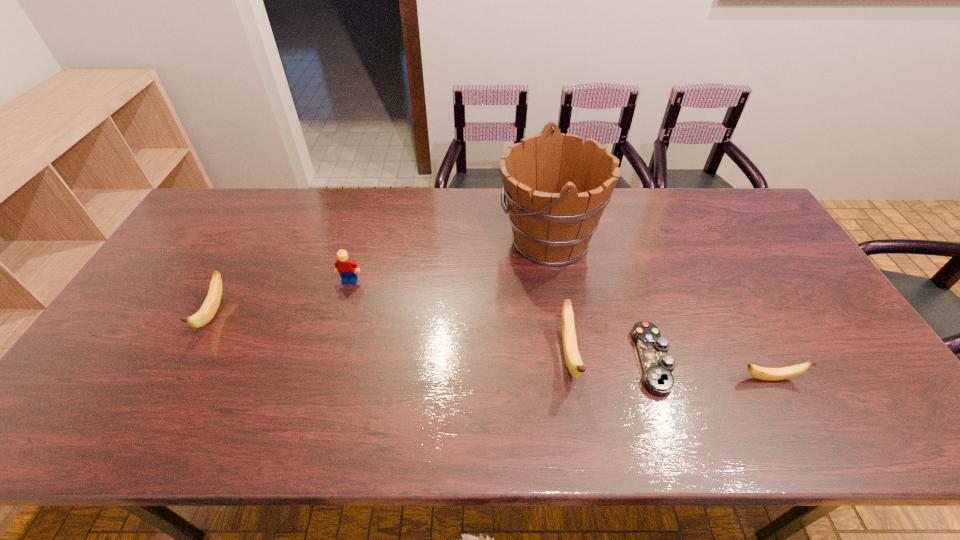
Where is `the second shortest banana`? The image size is (960, 540). the second shortest banana is located at coordinates (206, 313).

Identify the location of the leftmost banana. This screenshot has width=960, height=540. (206, 313).

Image resolution: width=960 pixels, height=540 pixels. I want to click on the second banana from left to right, so click(574, 363).

Where is `the rightmost object`? This screenshot has height=540, width=960. the rightmost object is located at coordinates (770, 374).

Where is `the fifth tallest object`? The image size is (960, 540). the fifth tallest object is located at coordinates (x=770, y=374).

Where is `the tallest object`? the tallest object is located at coordinates (556, 190).

Find the location of `the second object from left to right`. the second object from left to right is located at coordinates (344, 265).

Image resolution: width=960 pixels, height=540 pixels. Identify the location of the second object from right to left. (658, 366).

What are the coordinates of `the shortest object` in the screenshot? It's located at (658, 366).

This screenshot has height=540, width=960. I want to click on free space located 0.130m at the stem of the fourth tallest object, so click(x=175, y=387).